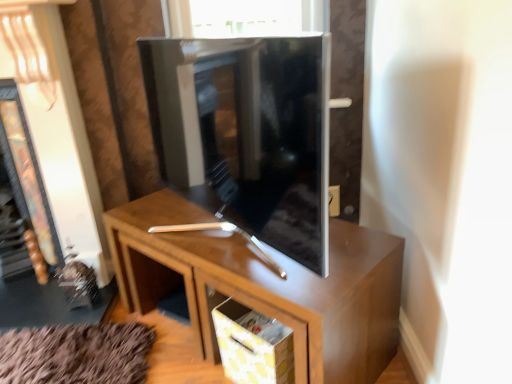
This screenshot has height=384, width=512. Identify the location of vacant space underneath glossy wood tv cabinet at center (from a real-world perspective). (212, 235).